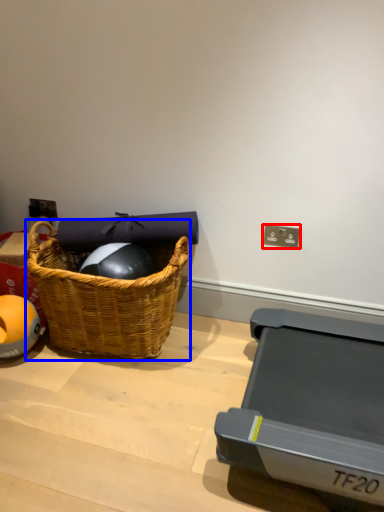
Question: Which object is closer to the camera taking this photo, electric outlet (highlighted by a red box) or picnic basket (highlighted by a blue box)?

Choices:
 (A) electric outlet
 (B) picnic basket

Answer: (B)